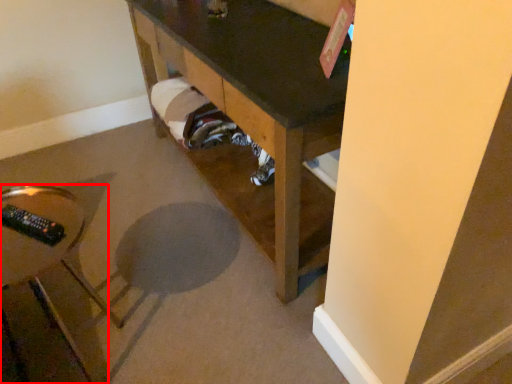
Question: From the image's perspective, where is furniture (annotated by the red box) located in relation to furniture in the image?

Choices:
 (A) above
 (B) below

Answer: (B)